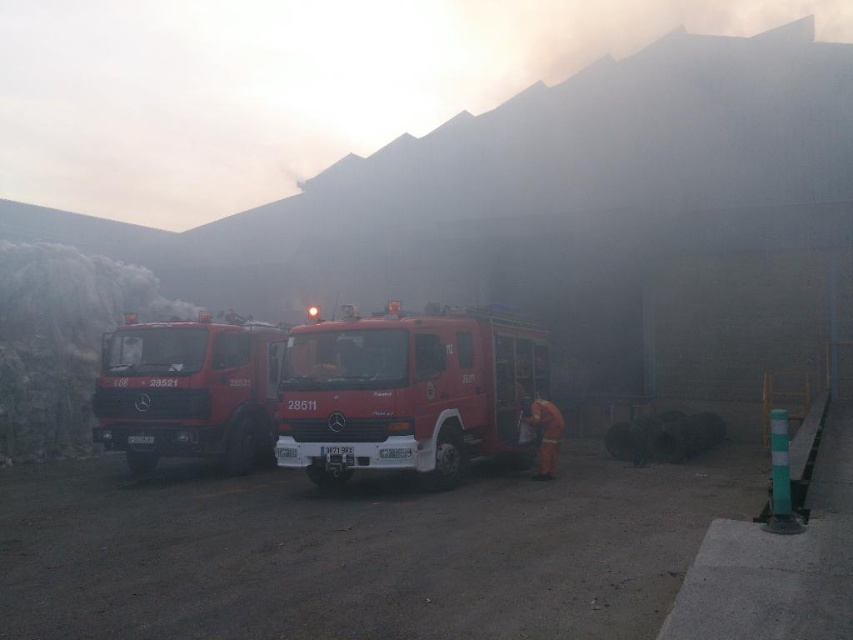
Question: Which object is the farthest from the orange fabric fireman at center?

Choices:
 (A) matte red fire truck at center
 (B) shiny red fire truck at center

Answer: (A)

Question: Which of these objects is positioned closest to the matte red fire truck at center?

Choices:
 (A) shiny red fire truck at center
 (B) orange fabric fireman at center

Answer: (A)

Question: Among these points, which one is nearest to the camera?

Choices:
 (A) (541, 442)
 (B) (157, 433)

Answer: (B)

Question: Is matte red fire truck at center to the right of orange fabric fireman at center from the viewer's perspective?

Choices:
 (A) yes
 (B) no

Answer: (B)

Question: In this image, where is shiny red fire truck at center located relative to orange fabric fireman at center?

Choices:
 (A) above
 (B) below

Answer: (A)

Question: In this image, where is shiny red fire truck at center located relative to matte red fire truck at center?

Choices:
 (A) left
 (B) right

Answer: (B)